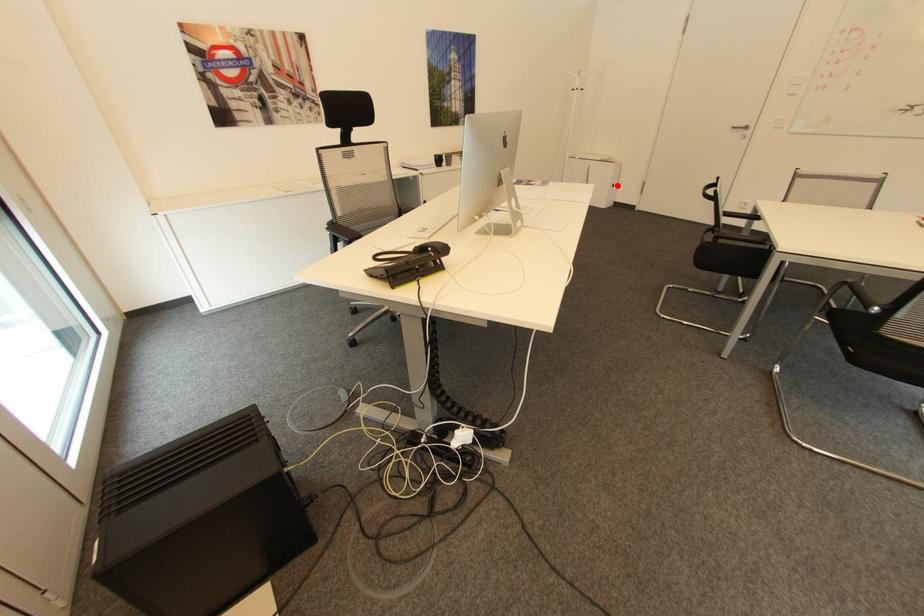
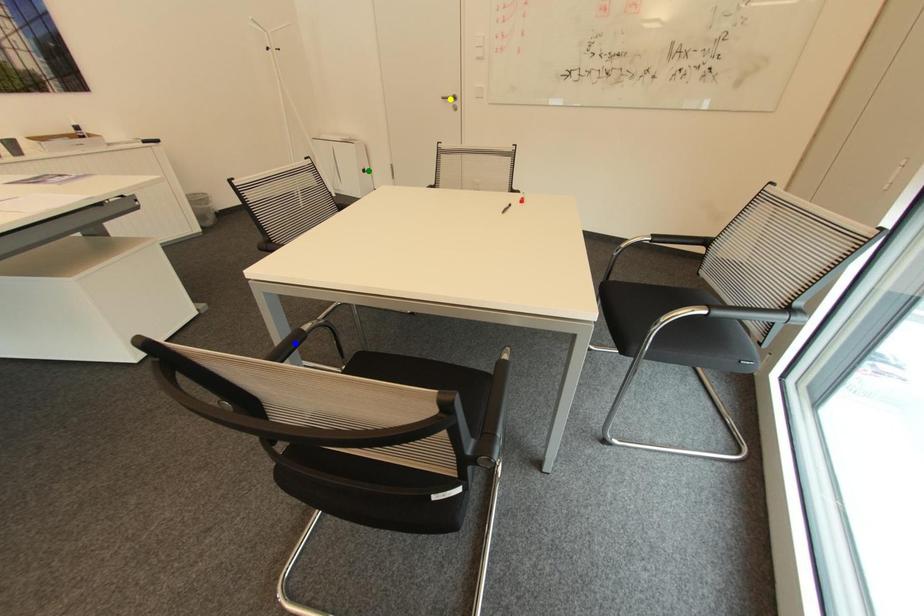
Question: I am providing you with two images of the same scene from different viewpoints. A red point is marked on the first image. You are given multiple points on the second image. Which point in image 2 is actually the same real-world point as the red point in image 1?

Choices:
 (A) blue point
 (B) yellow point
 (C) green point

Answer: (C)